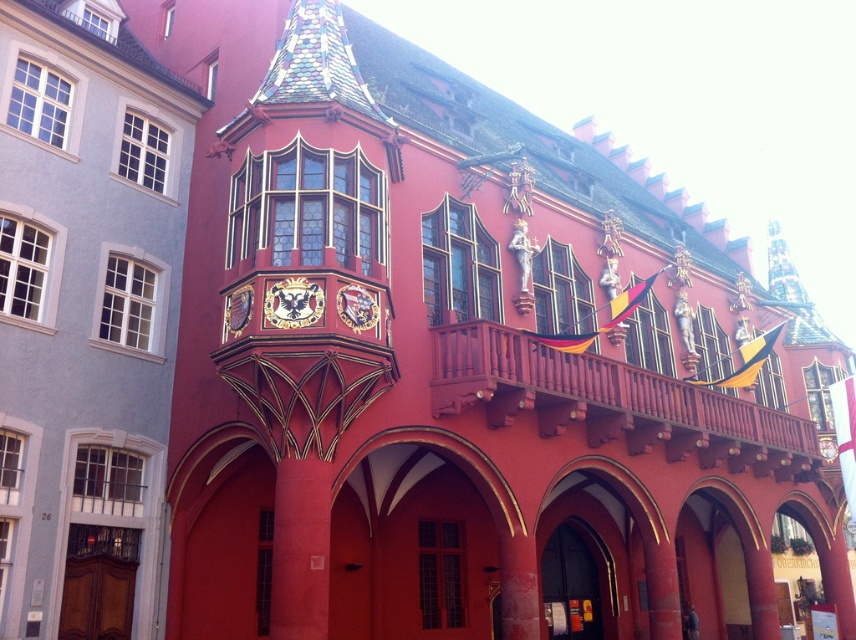
Can you confirm if wooden at center is positioned to the right of yellow-black-red fabric flag at center?

Yes, wooden at center is to the right of yellow-black-red fabric flag at center.

You are a GUI agent. You are given a task and a screenshot of the screen. Output one action in this format:
    pyautogui.click(x=<x>, y=<y>)
    Task: Click on the wooden at center
    This screenshot has width=856, height=640.
    Given the screenshot: What is the action you would take?
    pyautogui.click(x=613, y=403)

Between point (651, 422) and point (544, 339), which one is positioned behind?

Positioned behind is point (651, 422).

The width and height of the screenshot is (856, 640). What are the coordinates of `wooden at center` in the screenshot? It's located at (613, 403).

Is wooden at center taller than yellow and black fabric flag at upper right?

Indeed, wooden at center has a greater height compared to yellow and black fabric flag at upper right.

Who is taller, wooden at center or yellow and black fabric flag at upper right?

wooden at center is taller.

I want to click on wooden at center, so click(613, 403).

Is yellow-black-red fabric flag at center smaller than yellow and black fabric flag at upper right?

No.

Does yellow-black-red fabric flag at center have a larger size compared to yellow and black fabric flag at upper right?

Yes.

Between point (648, 284) and point (761, 353), which one is positioned behind?

Point (761, 353)

Locate an element on the screen. This screenshot has width=856, height=640. yellow-black-red fabric flag at center is located at coordinates (602, 324).